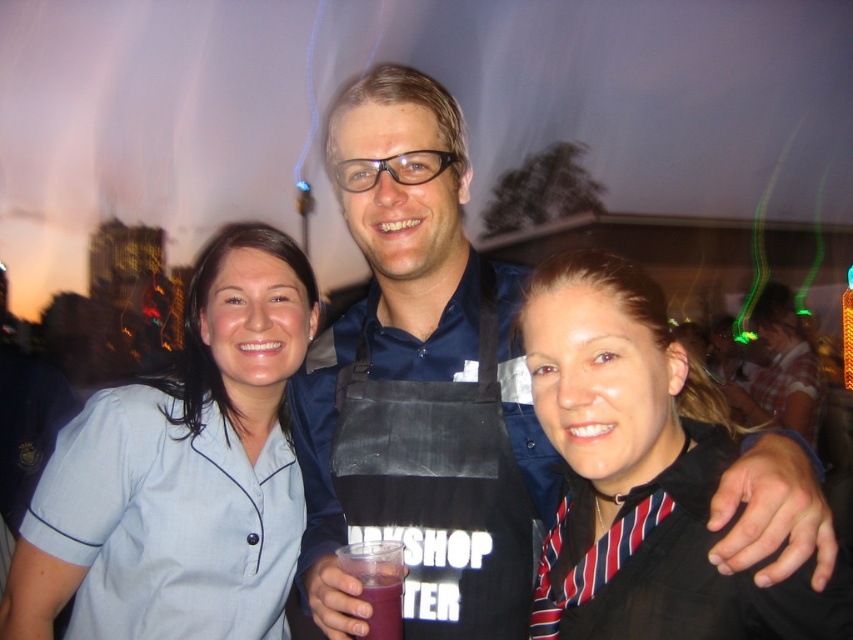
Question: Can you confirm if blue fabric shirt at center is positioned above striped fabric shirt at center?

Choices:
 (A) yes
 (B) no

Answer: (A)

Question: Is striped fabric shirt at center bigger than purple translucent cup at center?

Choices:
 (A) yes
 (B) no

Answer: (A)

Question: Which point appears closest to the camera in this image?

Choices:
 (A) (764, 298)
 (B) (393, 588)
 (C) (692, 552)
 (D) (334, 348)

Answer: (C)

Question: Which point is closer to the camera?

Choices:
 (A) (665, 536)
 (B) (109, 400)
 (C) (402, 568)
 (D) (341, 328)

Answer: (A)

Question: Can you confirm if light blue fabric shirt at center is thinner than black apron at center?

Choices:
 (A) yes
 (B) no

Answer: (A)

Question: Which point is farther to the camera?

Choices:
 (A) (186, 339)
 (B) (413, 250)
 (C) (805, 362)
 (D) (705, 396)

Answer: (C)